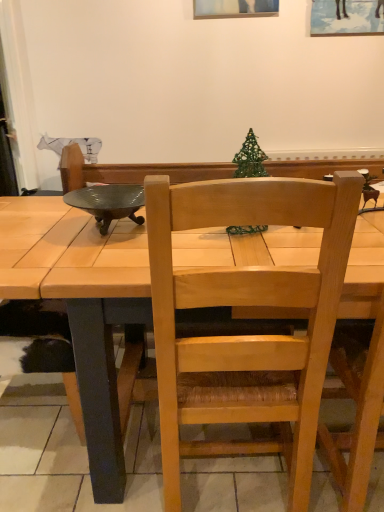
Question: Would you say light wood chair at center is inside or outside metallic green bowl at upper left?

Choices:
 (A) outside
 (B) inside

Answer: (A)

Question: Based on their sizes in the image, would you say light wood chair at center is bigger or smaller than metallic green bowl at upper left?

Choices:
 (A) small
 (B) big

Answer: (B)

Question: Is light wood chair at center in front of or behind metallic green bowl at upper left in the image?

Choices:
 (A) behind
 (B) front

Answer: (B)

Question: In terms of height, does metallic green bowl at upper left look taller or shorter compared to light wood chair at center?

Choices:
 (A) short
 (B) tall

Answer: (A)

Question: From the image's perspective, is metallic green bowl at upper left located above or below light wood chair at center?

Choices:
 (A) below
 (B) above

Answer: (B)

Question: Is point (144, 221) closer or farther from the camera than point (225, 408)?

Choices:
 (A) farther
 (B) closer

Answer: (A)

Question: In the image, is metallic green bowl at upper left on the left side or the right side of light wood chair at center?

Choices:
 (A) left
 (B) right

Answer: (A)